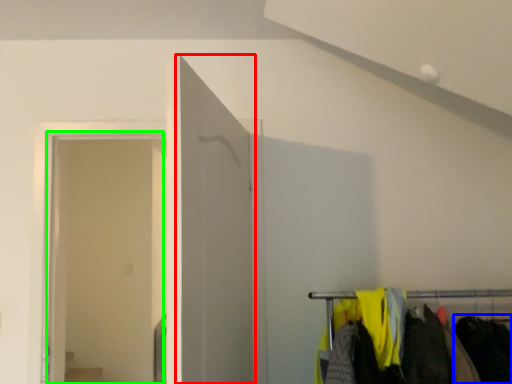
Question: Estimate the real-world distances between objects in this image. Which object is farther from door (highlighted by a red box), clothing (highlighted by a blue box) or glass door (highlighted by a green box)?

Choices:
 (A) clothing
 (B) glass door

Answer: (B)